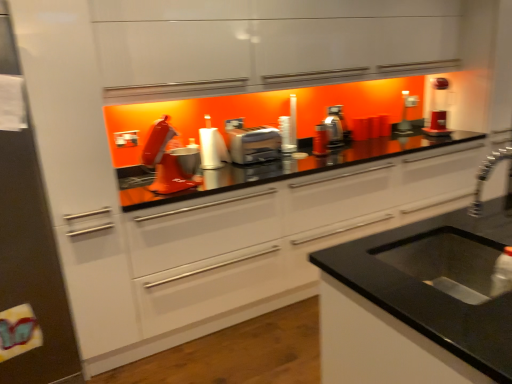
Locate an element on the screen. matte red coffee maker at upper right is located at coordinates (438, 109).

What is the approximate height of white matte refrigerator at left?

5.88 feet.

You are a GUI agent. You are given a task and a screenshot of the screen. Output one action in this format:
    pyautogui.click(x=<x>, y=<y>)
    Task: Click on the white matte refrigerator at left
    
    Given the screenshot: What is the action you would take?
    pyautogui.click(x=32, y=271)

What is the approximate width of metallic silver toaster at center, arranged as the 2th appliance when viewed from the left?

The width of metallic silver toaster at center, arranged as the 2th appliance when viewed from the left, is 6.44 inches.

This screenshot has width=512, height=384. What do you see at coordinates (164, 161) in the screenshot?
I see `matte red mixer at center, the first appliance in the left-to-right sequence` at bounding box center [164, 161].

How much space does matte red mixer at center, placed as the second appliance when sorted from right to left, occupy horizontally?

The width of matte red mixer at center, placed as the second appliance when sorted from right to left, is 23.48 centimeters.

Image resolution: width=512 pixels, height=384 pixels. I want to click on matte red coffee maker at upper right, so click(x=438, y=109).

Where is `kitchen appliance above the black granite sink at lower right (from a real-world perspective)`? kitchen appliance above the black granite sink at lower right (from a real-world perspective) is located at coordinates (254, 145).

What's the angular difference between matte white toaster at center and black granite sink at lower right's facing directions?

matte white toaster at center and black granite sink at lower right are facing 178 degrees away from each other.

Considering the sizes of objects matte white toaster at center and black granite sink at lower right in the image provided, who is smaller, matte white toaster at center or black granite sink at lower right?

Smaller between the two is matte white toaster at center.

Considering the positions of point (272, 159) and point (398, 253), is point (272, 159) closer or farther from the camera than point (398, 253)?

Point (272, 159) is positioned farther from the camera compared to point (398, 253).

From a real-world perspective, is matte white toaster at center positioned above or below matte red mixer at center, placed as the second appliance when sorted from right to left?

Clearly, from a real-world perspective, matte white toaster at center is below matte red mixer at center, placed as the second appliance when sorted from right to left.

Considering the sizes of objects matte white toaster at center and matte red mixer at center, which is counted as the first appliance, starting from the front, in the image provided, who is thinner, matte white toaster at center or matte red mixer at center, which is counted as the first appliance, starting from the front,?

With smaller width is matte red mixer at center, which is counted as the first appliance, starting from the front.

Is the position of matte white toaster at center less distant than that of matte red mixer at center, which is counted as the first appliance, starting from the front?

No, matte white toaster at center is further to the viewer.

Are matte white toaster at center and matte red mixer at center, marked as the first appliance in a bottom-to-top arrangement, located far from each other?

No, matte white toaster at center is not far away from matte red mixer at center, marked as the first appliance in a bottom-to-top arrangement.

Is matte red mixer at center, which appears as the 2th appliance when viewed from the back, not close to matte red coffee maker at upper right?

Yes, matte red mixer at center, which appears as the 2th appliance when viewed from the back, and matte red coffee maker at upper right are quite far apart.

Who is shorter, matte red mixer at center, which appears as the 2th appliance when viewed from the back, or matte red coffee maker at upper right?

matte red mixer at center, which appears as the 2th appliance when viewed from the back, is shorter.

Is matte red mixer at center, which appears as the 2th appliance when viewed from the back, behind matte red coffee maker at upper right?

No, matte red mixer at center, which appears as the 2th appliance when viewed from the back, is closer to the viewer.

Is matte red mixer at center, placed as the second appliance when sorted from right to left, inside the boundaries of matte red coffee maker at upper right, or outside?

matte red mixer at center, placed as the second appliance when sorted from right to left, exists outside the volume of matte red coffee maker at upper right.

Is white matte refrigerator at left placed right next to matte red mixer at center, which appears as the 2th appliance when viewed from the back?

white matte refrigerator at left and matte red mixer at center, which appears as the 2th appliance when viewed from the back, are clearly separated.

Could you tell me if white matte refrigerator at left is facing matte red mixer at center, placed as the second appliance when sorted from right to left?

No, white matte refrigerator at left is not oriented towards matte red mixer at center, placed as the second appliance when sorted from right to left.

Considering the relative positions of white matte refrigerator at left and matte red mixer at center, the first appliance in the left-to-right sequence, in the image provided, is white matte refrigerator at left to the left or to the right of matte red mixer at center, the first appliance in the left-to-right sequence,?

white matte refrigerator at left is positioned on matte red mixer at center, the first appliance in the left-to-right sequence,'s left side.

From the image's perspective, is white matte refrigerator at left under matte red mixer at center, the first appliance in the left-to-right sequence?

Indeed, from the image's perspective, white matte refrigerator at left is shown beneath matte red mixer at center, the first appliance in the left-to-right sequence.

From the picture: How many degrees apart are the facing directions of black granite sink at lower right and matte red mixer at center, placed as the second appliance when sorted from right to left?

The angle between the facing direction of black granite sink at lower right and the facing direction of matte red mixer at center, placed as the second appliance when sorted from right to left, is 165 degrees.

Is black granite sink at lower right at the right side of matte red mixer at center, placed as the second appliance when sorted from right to left?

Indeed, black granite sink at lower right is positioned on the right side of matte red mixer at center, placed as the second appliance when sorted from right to left.

Considering the relative sizes of black granite sink at lower right and matte red mixer at center, the second appliance viewed from the top, in the image provided, is black granite sink at lower right wider than matte red mixer at center, the second appliance viewed from the top,?

Yes.

Is black granite sink at lower right positioned beyond the bounds of matte red mixer at center, which is counted as the first appliance, starting from the front?

Yes, black granite sink at lower right is outside of matte red mixer at center, which is counted as the first appliance, starting from the front.

Between metallic silver toaster at center, the second appliance when ordered from bottom to top, and matte white toaster at center, which one has smaller width?

metallic silver toaster at center, the second appliance when ordered from bottom to top.

Can you confirm if metallic silver toaster at center, arranged as the 1th appliance when viewed from the right, is taller than matte white toaster at center?

Yes, metallic silver toaster at center, arranged as the 1th appliance when viewed from the right, is taller than matte white toaster at center.

I want to click on kitchen appliance on the left of the metallic silver toaster at center, the 1th appliance in the top-to-bottom sequence, so click(254, 145).

Considering the points (410, 125) and (271, 150), which point is behind, point (410, 125) or point (271, 150)?

Point (410, 125)

Is matte red coffee maker at upper right wider or thinner than matte white toaster at center?

In the image, matte red coffee maker at upper right appears to be more narrow than matte white toaster at center.

From a real-world perspective, is matte red coffee maker at upper right positioned over matte white toaster at center based on gravity?

Yes.

Is point (448, 83) in front of point (268, 138)?

No, it is behind (268, 138).

Which object is closer to the camera taking this photo, matte red coffee maker at upper right or matte white toaster at center?

matte white toaster at center is more forward.

Where is `kitchen appliance above the black granite sink at lower right (from a real-world perspective)`? Image resolution: width=512 pixels, height=384 pixels. kitchen appliance above the black granite sink at lower right (from a real-world perspective) is located at coordinates (254, 145).

Identify the location of appliance below the matte white toaster at center (from the image's perspective). This screenshot has height=384, width=512. (164, 161).

Looking at the image, which one is located closer to black granite sink at lower right, matte white toaster at center or metallic silver toaster at center, the 1th appliance in the back-to-front sequence?

Among the two, matte white toaster at center is located nearer to black granite sink at lower right.

Estimate the real-world distances between objects in this image. Which object is closer to matte red mixer at center, which appears as the 2th appliance when viewed from the back, matte red coffee maker at upper right or matte white toaster at center?

matte white toaster at center is positioned closer to the anchor matte red mixer at center, which appears as the 2th appliance when viewed from the back.

From the image, which object appears to be nearer to matte red coffee maker at upper right, matte red mixer at center, which appears as the 2th appliance when viewed from the back, or black granite sink at lower right?

The object closer to matte red coffee maker at upper right is matte red mixer at center, which appears as the 2th appliance when viewed from the back.

Based on their spatial positions, is black granite sink at lower right or metallic silver toaster at center, the second appliance when ordered from bottom to top, further from matte red coffee maker at upper right?

The object further to matte red coffee maker at upper right is black granite sink at lower right.

Based on their spatial positions, is black granite sink at lower right or metallic silver toaster at center, which is the 2th appliance from front to back, closer to matte white toaster at center?

Among the two, metallic silver toaster at center, which is the 2th appliance from front to back, is located nearer to matte white toaster at center.

Looking at the image, which one is located closer to matte red coffee maker at upper right, matte red mixer at center, the first appliance in the left-to-right sequence, or white matte refrigerator at left?

The object closer to matte red coffee maker at upper right is matte red mixer at center, the first appliance in the left-to-right sequence.

Based on the photo, considering their positions, is matte red mixer at center, which appears as the 2th appliance when viewed from the back, positioned closer to black granite sink at lower right than metallic silver toaster at center, the 1th appliance in the top-to-bottom sequence?

matte red mixer at center, which appears as the 2th appliance when viewed from the back, is closer to black granite sink at lower right.

From the image, which object appears to be farther from matte white toaster at center, matte red mixer at center, marked as the first appliance in a bottom-to-top arrangement, or white matte refrigerator at left?

Based on the image, white matte refrigerator at left appears to be further to matte white toaster at center.

Image resolution: width=512 pixels, height=384 pixels. Find the location of `kitchen appliance between white matte refrigerator at left and black granite sink at lower right`. kitchen appliance between white matte refrigerator at left and black granite sink at lower right is located at coordinates (254, 145).

Identify the location of appliance between matte red mixer at center, the first appliance in the left-to-right sequence, and matte red coffee maker at upper right from left to right. This screenshot has height=384, width=512. (406, 113).

Identify the location of appliance located between black granite sink at lower right and metallic silver toaster at center, the 1th appliance in the top-to-bottom sequence, in the depth direction. (164, 161).

I want to click on kitchen appliance located between black granite sink at lower right and metallic silver toaster at center, the 1th appliance in the back-to-front sequence, in the depth direction, so click(254, 145).